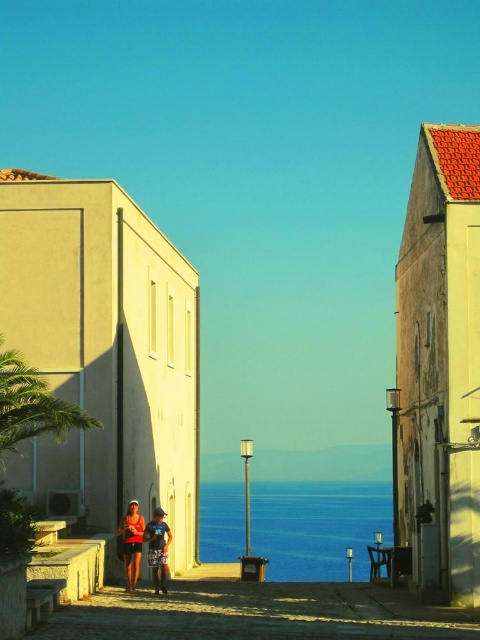
You are a photographer trying to capture a person wearing both a matte orange shorts at center and a matte orange tank top at center. If you want to ensure both items are in focus, what is the minimum distance you should set your camera lens to focus on?

The matte orange shorts at center is 5.59 inches away from the matte orange tank top at center. To ensure both are in focus, the camera lens should be set to a distance that accommodates this separation, typically focusing at the midpoint between them or using a smaller aperture for greater depth of field.

You are a photographer standing in the coastal scene. You notice the blue water at center and the matte orange shorts at center. Which object appears taller in the image?

The blue water at center is taller than the matte orange shorts at center according to the description.